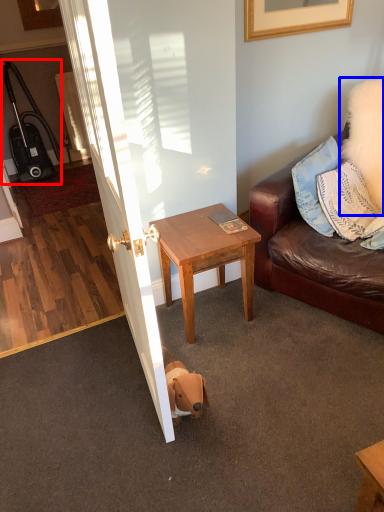
Question: Among these objects, which one is nearest to the camera, luggage (highlighted by a red box) or pillow (highlighted by a blue box)?

Choices:
 (A) luggage
 (B) pillow

Answer: (B)